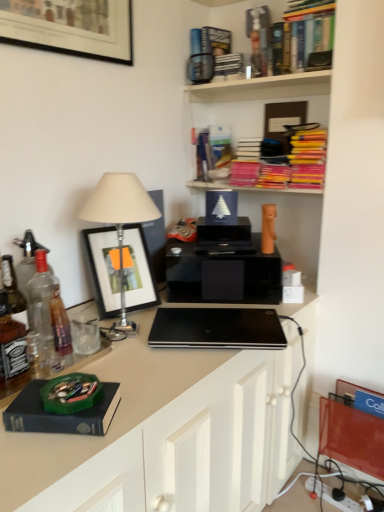
This screenshot has width=384, height=512. What do you see at coordinates (12, 348) in the screenshot? I see `clear glass bottle at left` at bounding box center [12, 348].

This screenshot has width=384, height=512. Identify the location of bright yellow markers at upper right, the first book when ordered from bottom to top. (308, 158).

How far apart are wooden bookshelf at upper center, which ranks as the 2th shelf in top-to-bottom order, and black matte laptop at center?

A distance of 3.29 feet exists between wooden bookshelf at upper center, which ranks as the 2th shelf in top-to-bottom order, and black matte laptop at center.

From the image's perspective, which is above, wooden bookshelf at upper center, which ranks as the 2th shelf in top-to-bottom order, or black matte laptop at center?

wooden bookshelf at upper center, which ranks as the 2th shelf in top-to-bottom order, from the image's perspective.

Where is `laptop to the left of wooden bookshelf at upper center, which ranks as the 2th shelf in top-to-bottom order`? laptop to the left of wooden bookshelf at upper center, which ranks as the 2th shelf in top-to-bottom order is located at coordinates (217, 329).

Is point (212, 95) closer to camera compared to point (158, 330)?

No, (212, 95) is further to viewer.

From the image's perspective, which book is the 2nd one above the hardcover book at upper center, the 2th book ordered from the bottom? Please provide its 2D coordinates.

[(206, 52)]

Is point (210, 152) less distant than point (216, 34)?

No, it is not.

In the scene shown: Is hardcover book at upper center, the 2th book ordered from the bottom, in contact with hardcover book at upper center, the 4th book positioned from the bottom?

No, hardcover book at upper center, the 2th book ordered from the bottom, is not with hardcover book at upper center, the 4th book positioned from the bottom.

In the scene shown: From the image's perspective, is black matte laptop at center on top of white plastic power strip at lower right?

Yes, from the image's perspective, black matte laptop at center is above white plastic power strip at lower right.

Which of these two, black matte laptop at center or white plastic power strip at lower right, stands shorter?

white plastic power strip at lower right is shorter.

How different are the orientations of black matte laptop at center and white plastic power strip at lower right in degrees?

40.4 degrees.

Is point (222, 347) positioned behind point (335, 501)?

No, it is in front of (335, 501).

Identify the location of paperback book lying below the pink matte books at upper center, arranged as the first shelf when ordered from the bottom (from the image's perspective). The width and height of the screenshot is (384, 512). [61, 415].

Is dark blue matte book at lower left taller or shorter than pink matte books at upper center, arranged as the first shelf when ordered from the bottom?

dark blue matte book at lower left is shorter than pink matte books at upper center, arranged as the first shelf when ordered from the bottom.

Would you consider dark blue matte book at lower left to be distant from pink matte books at upper center, arranged as the first shelf when ordered from the bottom?

Yes, dark blue matte book at lower left and pink matte books at upper center, arranged as the first shelf when ordered from the bottom, are quite far apart.

Is point (50, 420) closer to viewer compared to point (222, 189)?

Yes, it is.

From the picture: Between pink matte books at upper center, arranged as the first shelf when ordered from the bottom, and clear glass bottle at left, which one appears on the right side from the viewer's perspective?

Positioned to the right is pink matte books at upper center, arranged as the first shelf when ordered from the bottom.

Consider the image. Between pink matte books at upper center, the 3th shelf when ordered from top to bottom, and clear glass bottle at left, which one has more height?

With more height is clear glass bottle at left.

Is pink matte books at upper center, the 3th shelf when ordered from top to bottom, smaller than clear glass bottle at left?

Actually, pink matte books at upper center, the 3th shelf when ordered from top to bottom, might be larger than clear glass bottle at left.

Locate an element on the screen. This screenshot has height=512, width=384. book that is the 2nd one when counting backward from the pink matte books at upper center, arranged as the first shelf when ordered from the bottom is located at coordinates (212, 153).

Is there a large distance between pink matte books at upper center, the 3th shelf when ordered from top to bottom, and hardcover book at upper center, which is the 3th book in top-to-bottom order?

No, pink matte books at upper center, the 3th shelf when ordered from top to bottom, is not far away from hardcover book at upper center, which is the 3th book in top-to-bottom order.

Is pink matte books at upper center, arranged as the first shelf when ordered from the bottom, completely or partially outside of hardcover book at upper center, the 2th book ordered from the bottom?

Yes.

From the image's perspective, is pink matte books at upper center, the 3th shelf when ordered from top to bottom, over hardcover book at upper center, which is the 3th book in top-to-bottom order?

No, from the image's perspective, pink matte books at upper center, the 3th shelf when ordered from top to bottom, is not above hardcover book at upper center, which is the 3th book in top-to-bottom order.

Are hardcover book at upper center, the 2th book ordered from the bottom, and bright yellow markers at upper right, the first book when ordered from bottom to top, located far from each other?

That's not correct — hardcover book at upper center, the 2th book ordered from the bottom, is a little close to bright yellow markers at upper right, the first book when ordered from bottom to top.

Is hardcover book at upper center, which is the 3th book in top-to-bottom order, to the left or to the right of bright yellow markers at upper right, the first book when ordered from bottom to top, in the image?

hardcover book at upper center, which is the 3th book in top-to-bottom order, is to the left of bright yellow markers at upper right, the first book when ordered from bottom to top.

From the image's perspective, relative to bright yellow markers at upper right, which is the 4th book from top to bottom, is hardcover book at upper center, the 2th book ordered from the bottom, above or below?

Based on their image positions, hardcover book at upper center, the 2th book ordered from the bottom, is located above bright yellow markers at upper right, which is the 4th book from top to bottom.

Between hardcover book at upper center, which is the 3th book in top-to-bottom order, and bright yellow markers at upper right, which is the 4th book from top to bottom, which one has larger size?

Bigger between the two is hardcover book at upper center, which is the 3th book in top-to-bottom order.

This screenshot has height=512, width=384. I want to click on laptop below the wooden bookshelf at upper center, which ranks as the 2th shelf in top-to-bottom order (from a real-world perspective), so coord(217,329).

At what (x,y) coordinates should I click in order to perform the action: click on the 1st book in front of the hardcover book at upper center, the 2th book ordered from the bottom, starting your count from the anchor. Please return your answer as a coordinate pair (x, y). The image size is (384, 512). Looking at the image, I should click on point(206,52).

From the image, which object appears to be nearer to clear glass bottle at left, hardcover books at upper right, placed as the third book when sorted from bottom to top, or hardcover books at upper center, the 3th shelf from the bottom?

The object closer to clear glass bottle at left is hardcover books at upper center, the 3th shelf from the bottom.

From the image, which object appears to be farther from hardcover book at upper center, which is the 3th book in top-to-bottom order, hardcover books at upper center, marked as the 1th shelf in a top-to-bottom arrangement, or dark blue matte book at lower left?

Among the two, dark blue matte book at lower left is located further to hardcover book at upper center, which is the 3th book in top-to-bottom order.

When comparing their distances from bright yellow markers at upper right, which is the 4th book from top to bottom, does hardcover book at upper center, the 2th book ordered from the bottom, or black matte laptop at center seem further?

black matte laptop at center.

When comparing their distances from clear glass bottle at left, does black matte laptop at center or dark blue matte book at lower left seem further?

Among the two, black matte laptop at center is located further to clear glass bottle at left.

From the image, which object appears to be nearer to dark blue matte book at lower left, hardcover book at upper center, the 4th book positioned from the bottom, or hardcover books at upper center, marked as the 1th shelf in a top-to-bottom arrangement?

hardcover books at upper center, marked as the 1th shelf in a top-to-bottom arrangement, lies closer to dark blue matte book at lower left than the other object.

Considering their positions, is pink matte books at upper center, the 3th shelf when ordered from top to bottom, positioned closer to bright yellow markers at upper right, the first book when ordered from bottom to top, than dark blue matte book at lower left?

pink matte books at upper center, the 3th shelf when ordered from top to bottom.

Estimate the real-world distances between objects in this image. Which object is further from pink matte books at upper center, arranged as the first shelf when ordered from the bottom, hardcover books at upper center, the 3th shelf from the bottom, or white plastic power strip at lower right?

Based on the image, white plastic power strip at lower right appears to be further to pink matte books at upper center, arranged as the first shelf when ordered from the bottom.

In the scene shown: From the image, which object appears to be nearer to hardcover book at upper center, which is the 3th book in top-to-bottom order, black matte laptop at center or hardcover books at upper center, the 3th shelf from the bottom?

Based on the image, hardcover books at upper center, the 3th shelf from the bottom, appears to be nearer to hardcover book at upper center, which is the 3th book in top-to-bottom order.

I want to click on laptop positioned between dark blue matte book at lower left and hardcover book at upper center, which is the 3th book in top-to-bottom order, from near to far, so click(x=217, y=329).

I want to click on laptop situated between clear glass bottle at left and white plastic power strip at lower right from left to right, so click(x=217, y=329).

This screenshot has width=384, height=512. Find the location of `wine bottle between wooden bookshelf at upper center, marked as the second shelf in a bottom-to-top arrangement, and white plastic power strip at lower right from top to bottom`. wine bottle between wooden bookshelf at upper center, marked as the second shelf in a bottom-to-top arrangement, and white plastic power strip at lower right from top to bottom is located at coordinates (12, 348).

Where is `laptop situated between clear glass bottle at left and pink matte books at upper center, the 3th shelf when ordered from top to bottom, from left to right`? laptop situated between clear glass bottle at left and pink matte books at upper center, the 3th shelf when ordered from top to bottom, from left to right is located at coordinates (217, 329).